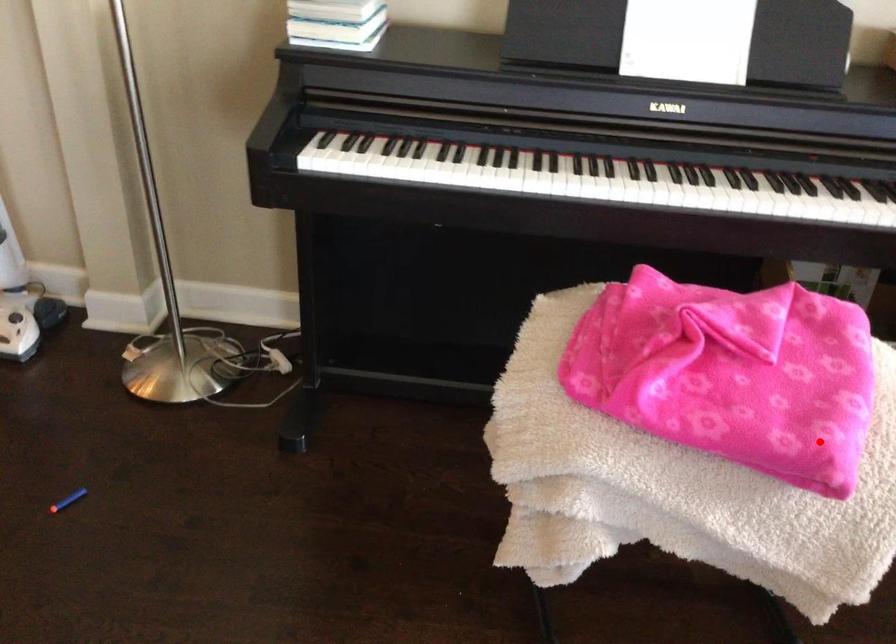
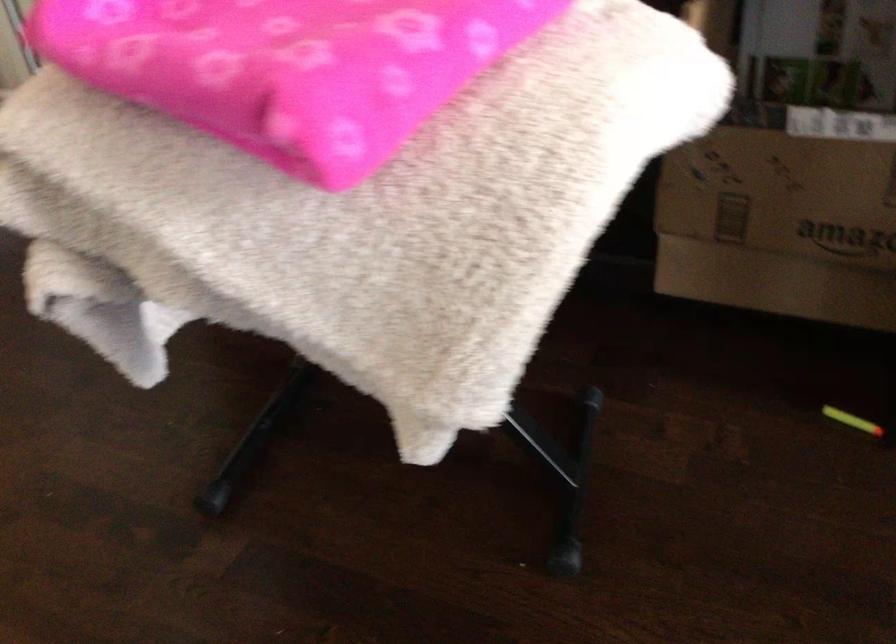
Question: I am providing you with two images of the same scene from different viewpoints. In image1, a red point is highlighted. Considering the same 3D point in image2, which of the following is correct?

Choices:
 (A) It is closer
 (B) It is farther

Answer: (A)